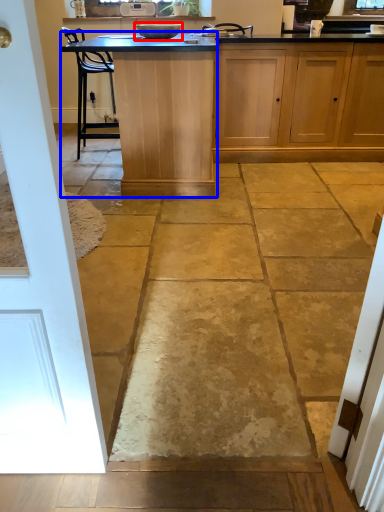
Question: Which point is further to the camera, appliance (highlighted by a red box) or table (highlighted by a blue box)?

Choices:
 (A) appliance
 (B) table

Answer: (A)